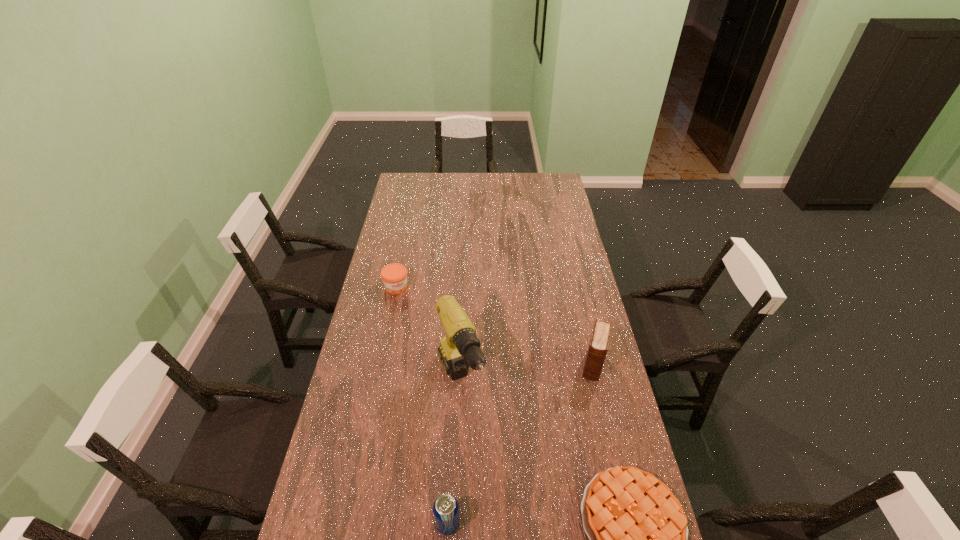
Find the location of a particular element. This screenshot has height=540, width=960. free space located on the spine side of the fourth shortest object is located at coordinates (583, 429).

Identify the location of vacant space located 0.050m on the spine side of the fourth shortest object. Image resolution: width=960 pixels, height=540 pixels. (590, 393).

You are a GUI agent. You are given a task and a screenshot of the screen. Output one action in this format:
    pyautogui.click(x=<x>, y=<y>)
    Task: Click on the vacant space located on the handle side of the tallest object
    
    Given the screenshot: What is the action you would take?
    pyautogui.click(x=491, y=464)

You are a GUI agent. You are given a task and a screenshot of the screen. Output one action in this format:
    pyautogui.click(x=<x>, y=<y>)
    Task: Click on the vacant region located on the handle side of the tallest object
    The height and width of the screenshot is (540, 960).
    Given the screenshot: What is the action you would take?
    pyautogui.click(x=504, y=493)

Where is `free space located on the handle side of the tallest object`? The width and height of the screenshot is (960, 540). free space located on the handle side of the tallest object is located at coordinates (511, 507).

You are a GUI agent. You are given a task and a screenshot of the screen. Output one action in this format:
    pyautogui.click(x=<x>, y=<y>)
    Task: Click on the object that is at the near edge
    
    Given the screenshot: What is the action you would take?
    pyautogui.click(x=445, y=508)

Identify the location of object that is at the left edge. (394, 276).

You are a GUI agent. You are given a task and a screenshot of the screen. Output one action in this format:
    pyautogui.click(x=<x>, y=<y>)
    Task: Click on the object that is at the right edge
    This screenshot has height=540, width=960.
    Given the screenshot: What is the action you would take?
    pyautogui.click(x=599, y=342)

This screenshot has height=540, width=960. What are the coordinates of `vacant space at the far edge of the desktop` in the screenshot? It's located at (510, 175).

In the image, there is a desktop. Where is `free space at the left edge`? free space at the left edge is located at coordinates [x=378, y=303].